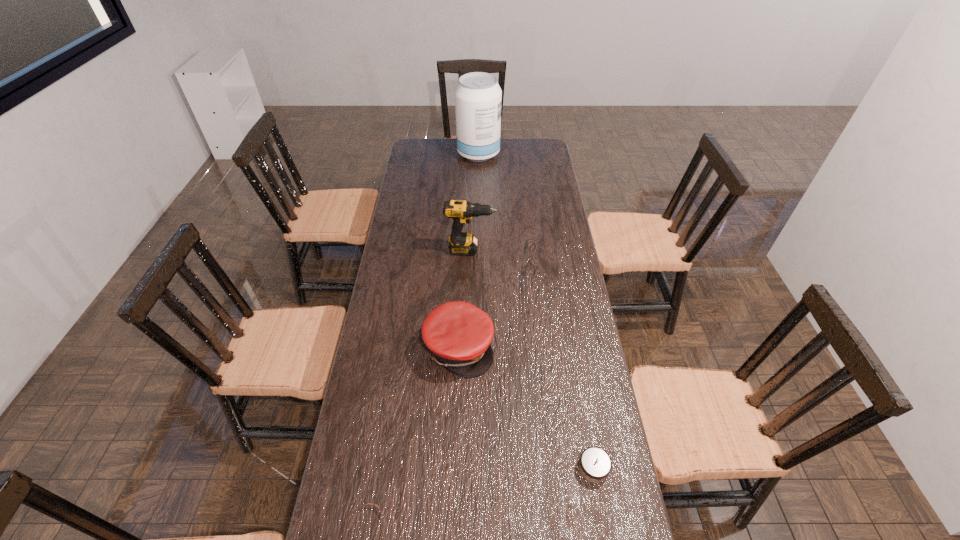
You are a GUI agent. You are given a task and a screenshot of the screen. Output one action in this format:
    pyautogui.click(x=<x>, y=<y>)
    Task: Click on the free space between the tallest object and the rightmost object
    The height and width of the screenshot is (540, 960).
    Given the screenshot: What is the action you would take?
    pyautogui.click(x=536, y=311)

The height and width of the screenshot is (540, 960). I want to click on vacant area that lies between the farthest object and the second farthest object, so click(474, 202).

Where is `vacant area between the rightmost object and the second farthest object`? The width and height of the screenshot is (960, 540). vacant area between the rightmost object and the second farthest object is located at coordinates (532, 359).

Identify which object is the fourth nearest to the second farthest object. Please provide its 2D coordinates. Your answer should be formatted as a tuple, i.e. [(x, y)], where the tuple contains the x and y coordinates of a point satisfying the conditions above.

[(367, 503)]

Locate an element on the screen. This screenshot has height=540, width=960. the fourth closest object relative to the fourth nearest object is located at coordinates (367, 503).

The width and height of the screenshot is (960, 540). Identify the location of free spot that satisfies the following two spatial constraints: 1. on the front-facing side of the cap; 2. on the left side of the second nearest object. (454, 468).

Locate an element on the screen. This screenshot has width=960, height=540. free location that satisfies the following two spatial constraints: 1. on the back side of the rightmost object; 2. on the front-facing side of the third farthest object is located at coordinates (572, 347).

Locate an element on the screen. The image size is (960, 540). vacant region that satisfies the following two spatial constraints: 1. on the front-facing side of the chocolate cake; 2. on the left side of the cap is located at coordinates (454, 468).